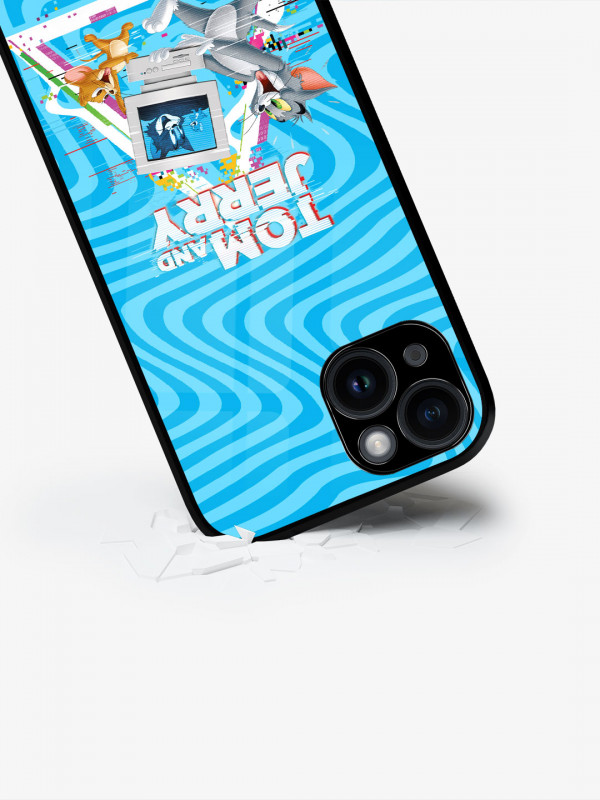
At what (x,y) coordinates should I click in order to perform the action: click on monitor. Please return your answer as a coordinate pair (x, y). The height and width of the screenshot is (800, 600). Looking at the image, I should click on point(201,118).